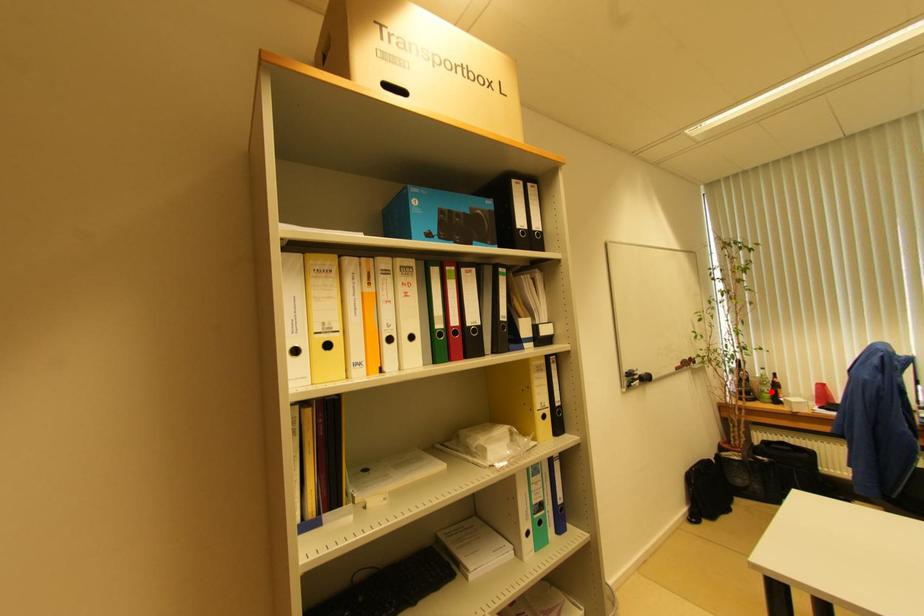
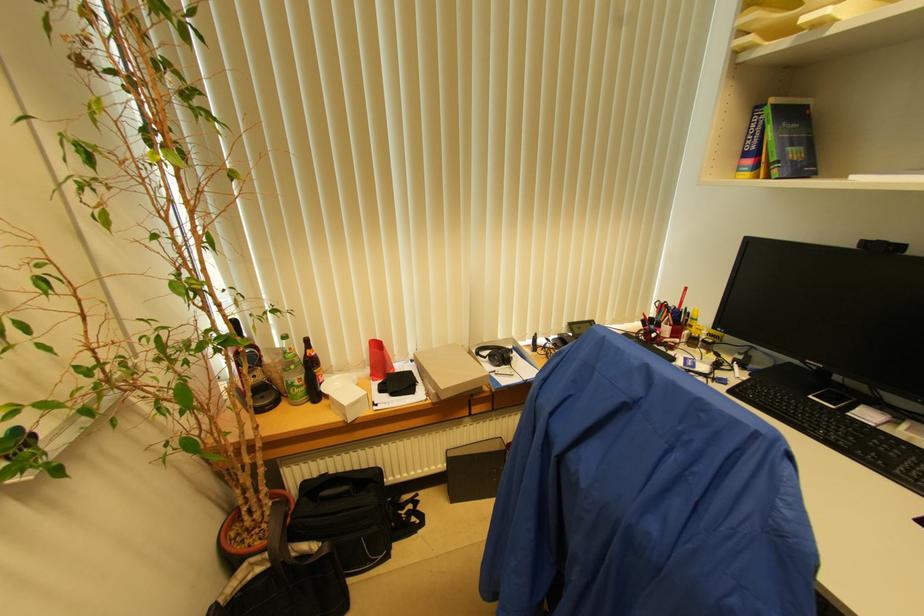
The point at the highlighted location is marked in the first image. Where is the corresponding point in the second image?

(304, 379)